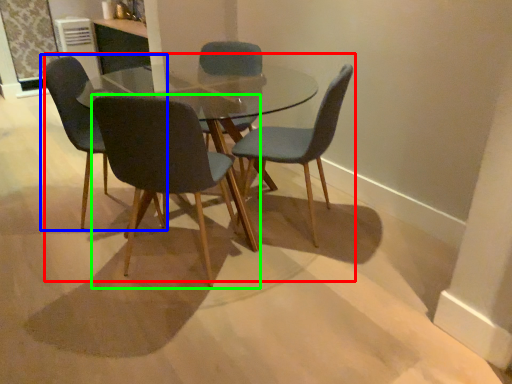
Question: Estimate the real-world distances between objects in this image. Which object is closer to kitchen & dining room table (highlighted by a red box), chair (highlighted by a blue box) or chair (highlighted by a green box)?

Choices:
 (A) chair
 (B) chair

Answer: (B)